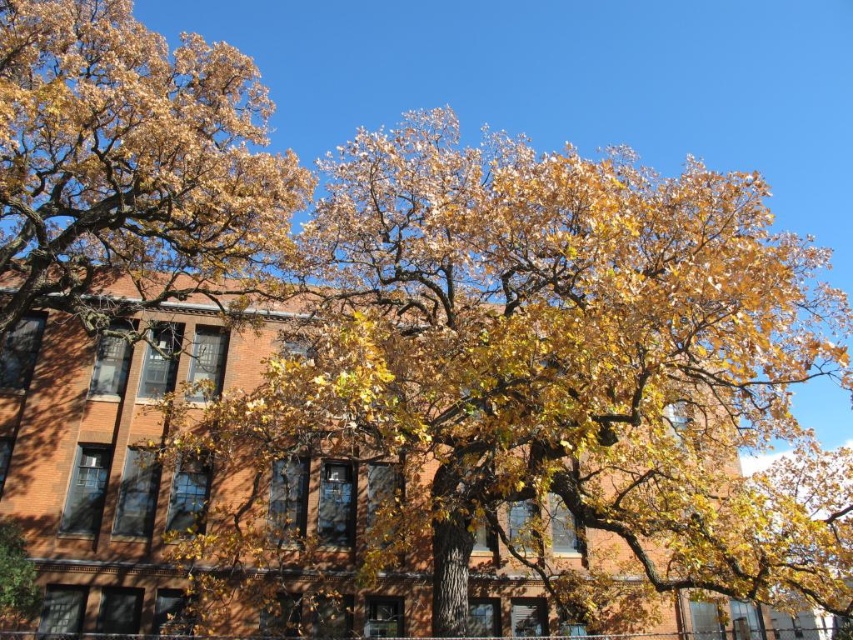
Question: Is yellow leafy oak tree at left thinner than yellow leafy tree at upper left?

Choices:
 (A) yes
 (B) no

Answer: (B)

Question: Is yellow leafy oak tree at left below yellow leafy tree at upper left?

Choices:
 (A) yes
 (B) no

Answer: (A)

Question: Which point is closer to the camera?

Choices:
 (A) (3, 221)
 (B) (345, 428)

Answer: (B)

Question: Does yellow leafy oak tree at left have a greater width compared to yellow leafy tree at upper left?

Choices:
 (A) yes
 (B) no

Answer: (A)

Question: Which point is farther to the camera?

Choices:
 (A) (505, 376)
 (B) (68, 106)

Answer: (B)

Question: Which of the following is the closest to the observer?

Choices:
 (A) (598, 266)
 (B) (173, 150)

Answer: (A)